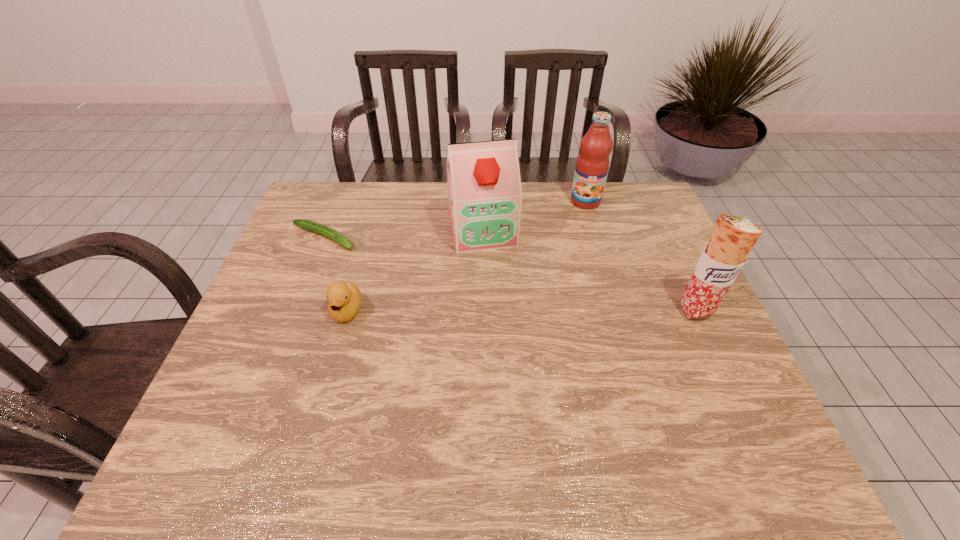
I want to click on object that is positioned at the right edge, so [x=733, y=237].

This screenshot has height=540, width=960. Identify the location of object situated at the far left corner. (309, 225).

The image size is (960, 540). In order to click on free space at the far edge in this screenshot , I will do `click(400, 185)`.

Where is `vacant space at the near edge of the desktop`? This screenshot has width=960, height=540. vacant space at the near edge of the desktop is located at coordinates (527, 410).

The image size is (960, 540). In the image, there is a desktop. Identify the location of vacant space at the left edge. (275, 267).

Identify the location of vacant space at the right edge. coord(693,330).

The height and width of the screenshot is (540, 960). Find the location of `vacant space at the near left corner of the desktop`. vacant space at the near left corner of the desktop is located at coordinates (251, 390).

In the image, there is a desktop. Identify the location of vacant space at the near right corner. The image size is (960, 540). (720, 413).

This screenshot has width=960, height=540. Identify the location of vacant area between the second shortest object and the soya milk. (415, 271).

This screenshot has height=540, width=960. Find the location of `vacant area that lies between the third object from left to right and the zucchini`. vacant area that lies between the third object from left to right and the zucchini is located at coordinates (403, 234).